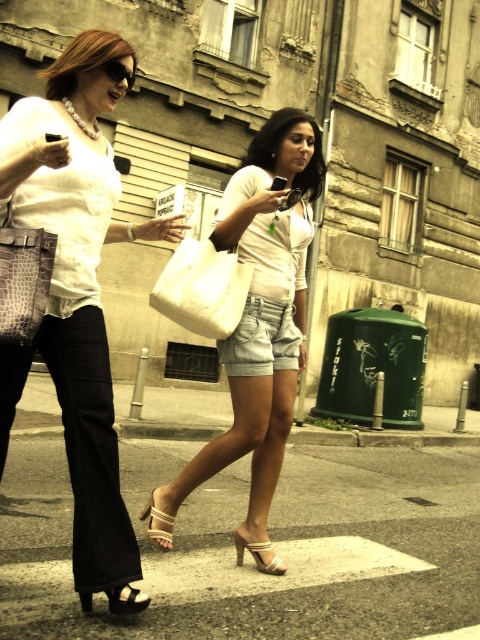
Between matte white blouse at center and beige leather sandal at center, which one appears on the left side from the viewer's perspective?

From the viewer's perspective, matte white blouse at center appears more on the left side.

Between matte white blouse at center and beige leather sandal at center, which one has more height?

matte white blouse at center

What do you see at coordinates (75, 288) in the screenshot? The image size is (480, 640). I see `matte white blouse at center` at bounding box center [75, 288].

Where is `matte white blouse at center`? The image size is (480, 640). matte white blouse at center is located at coordinates (75, 288).

Is matte white blouse at center positioned behind matte black sunglasses at upper left?

No, it is not.

From the picture: Can you confirm if matte white blouse at center is thinner than matte black sunglasses at upper left?

Incorrect, matte white blouse at center's width is not less than matte black sunglasses at upper left's.

The width and height of the screenshot is (480, 640). What are the coordinates of `matte white blouse at center` in the screenshot? It's located at (75, 288).

You are a GUI agent. You are given a task and a screenshot of the screen. Output one action in this format:
    pyautogui.click(x=<x>, y=<y>)
    Task: Click on the matte white blouse at center
    This screenshot has width=480, height=640.
    Given the screenshot: What is the action you would take?
    pyautogui.click(x=75, y=288)

Who is more distant from viewer, (140, 608) or (253, 556)?

The point (253, 556) is more distant.

Where is `leather high-heeled sandal at lower left`? The height and width of the screenshot is (640, 480). leather high-heeled sandal at lower left is located at coordinates (126, 600).